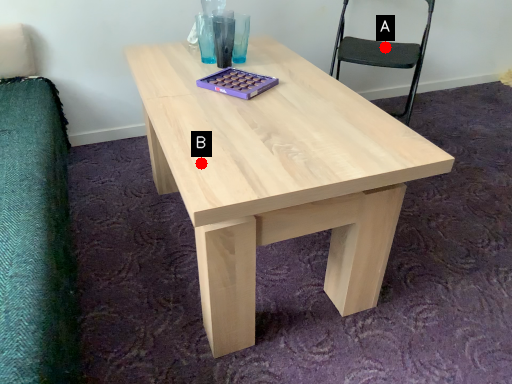
Question: Two points are circled on the image, labeled by A and B beside each circle. Which point is closer to the camera taking this photo?

Choices:
 (A) A is closer
 (B) B is closer

Answer: (B)